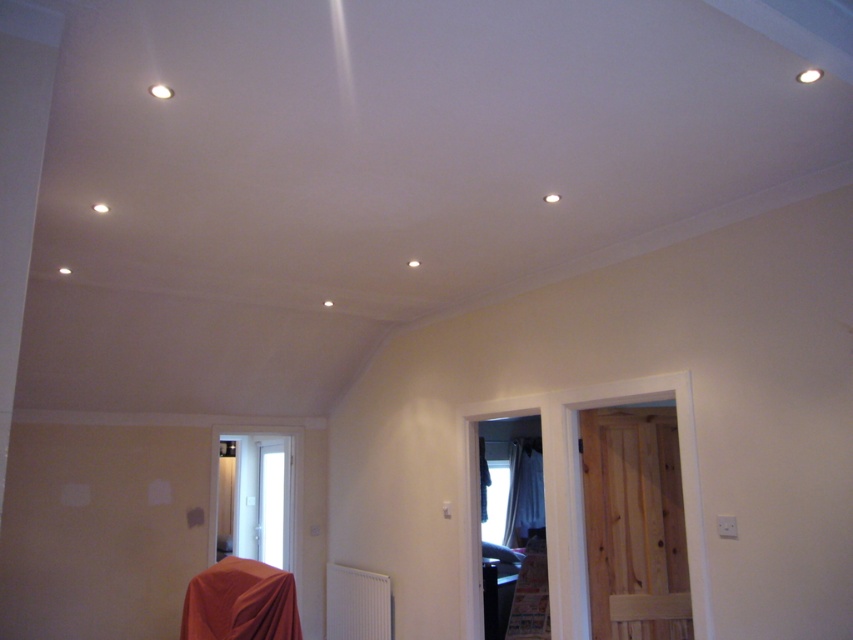
Question: In this image, where is orange fabric at lower left located relative to white sheer curtain at right?

Choices:
 (A) below
 (B) above

Answer: (B)

Question: Which object appears closest to the camera in this image?

Choices:
 (A) orange fabric at lower left
 (B) white sheer curtain at right

Answer: (A)

Question: Is orange fabric at lower left to the left of white sheer curtain at right from the viewer's perspective?

Choices:
 (A) no
 (B) yes

Answer: (B)

Question: In this image, where is orange fabric at lower left located relative to white sheer curtain at right?

Choices:
 (A) below
 (B) above

Answer: (B)

Question: Which object is closer to the camera taking this photo?

Choices:
 (A) white sheer curtain at right
 (B) orange fabric at lower left

Answer: (B)

Question: Which object appears farthest from the camera in this image?

Choices:
 (A) white sheer curtain at right
 (B) orange fabric at lower left

Answer: (A)